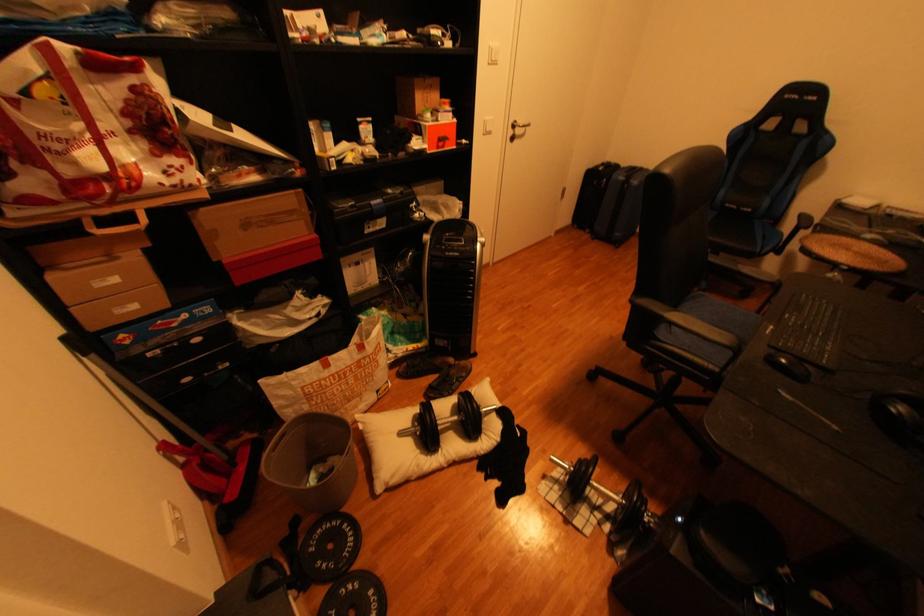
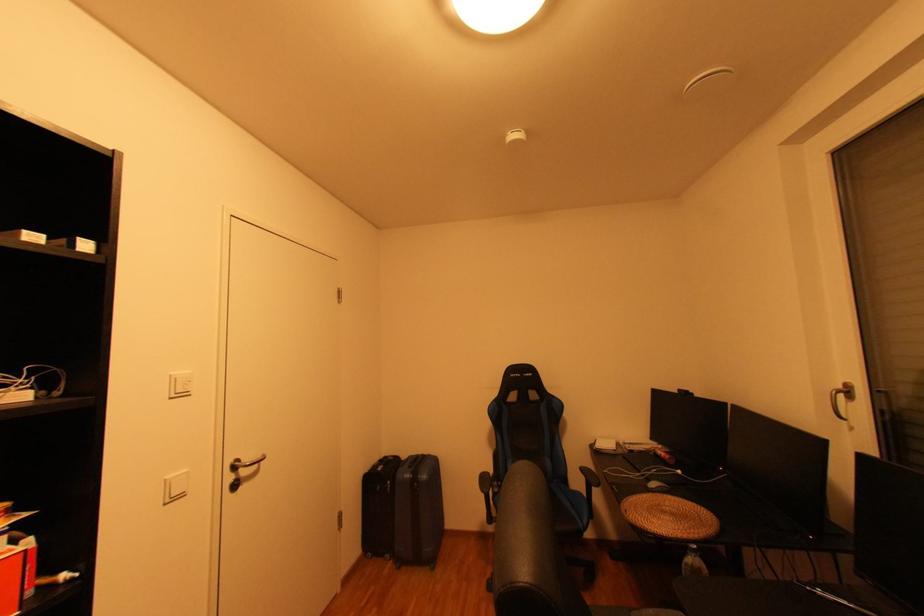
Locate, in the second image, the point that corresponds to pixel 525 121 in the first image.

(247, 461)